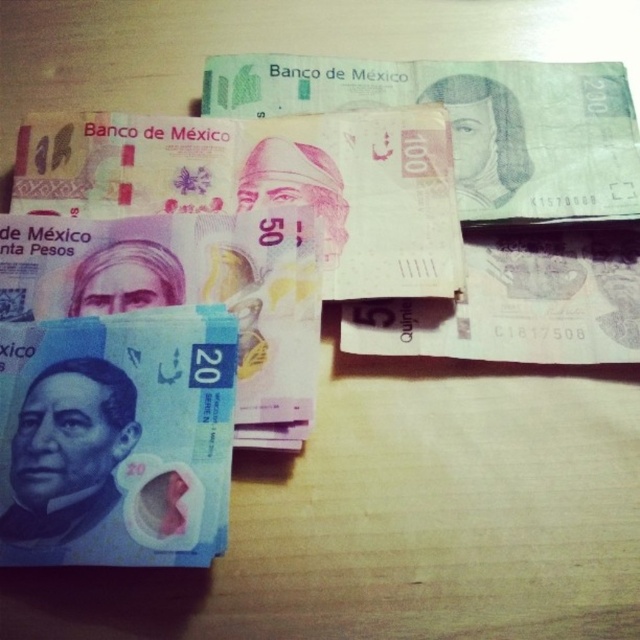
Looking at this image, you are a currency collector who wants to organize the Mexican banknotes on the wooden surface. You have a 50 pesos note and a blue paper currency at lower left. Which note should you place first if you want to arrange them from left to right based on their positions?

The blue paper currency at lower left should be placed first since it is positioned at the leftmost side compared to the 50 pesos note.

You are organizing a collection of Mexican currency notes on a wooden table. You have a blue paper currency at lower left and a blue paper currency at left. Which one is smaller in size?

The blue paper currency at lower left is smaller in size compared to the blue paper currency at left.